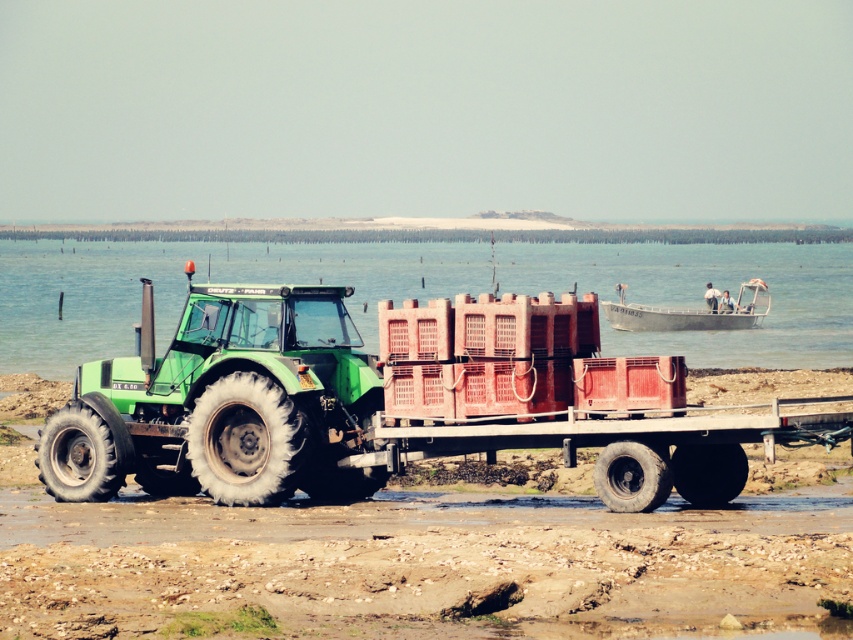
Question: Does green rubber tractor at center appear on the left side of metallic gray boat at right?

Choices:
 (A) yes
 (B) no

Answer: (A)

Question: Among these objects, which one is farthest from the camera?

Choices:
 (A) metallic gray boat at right
 (B) green rubber tractor at center

Answer: (A)

Question: Among these objects, which one is nearest to the camera?

Choices:
 (A) green matte trailer truck at center
 (B) green matte tractor at center
 (C) metallic gray boat at right

Answer: (A)

Question: Does green matte trailer truck at center come in front of green matte tractor at center?

Choices:
 (A) yes
 (B) no

Answer: (A)

Question: Is green rubber tractor at center above metallic gray boat at right?

Choices:
 (A) no
 (B) yes

Answer: (A)

Question: Which point is closer to the camera taking this photo?

Choices:
 (A) (340, 349)
 (B) (717, 321)

Answer: (A)